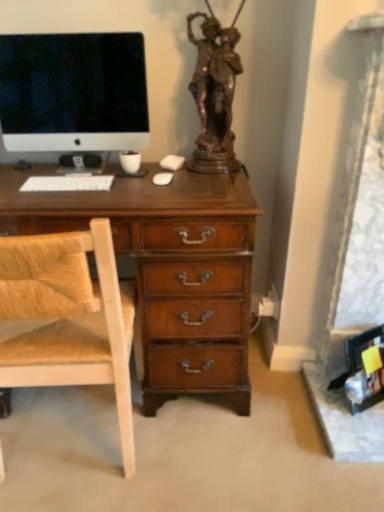
Question: Is light brown wood chair at left to the right of white glossy computer monitor at upper left from the viewer's perspective?

Choices:
 (A) no
 (B) yes

Answer: (B)

Question: Could white glossy computer monitor at upper left be considered to be inside light brown wood chair at left?

Choices:
 (A) yes
 (B) no

Answer: (B)

Question: Considering the relative sizes of light brown wood chair at left and white glossy computer monitor at upper left in the image provided, is light brown wood chair at left taller than white glossy computer monitor at upper left?

Choices:
 (A) yes
 (B) no

Answer: (A)

Question: From a real-world perspective, is light brown wood chair at left beneath white glossy computer monitor at upper left?

Choices:
 (A) no
 (B) yes

Answer: (B)

Question: From a real-world perspective, is light brown wood chair at left over white glossy computer monitor at upper left?

Choices:
 (A) yes
 (B) no

Answer: (B)

Question: Considering the positions of point (187, 32) and point (77, 181), is point (187, 32) closer or farther from the camera than point (77, 181)?

Choices:
 (A) farther
 (B) closer

Answer: (A)

Question: Is bronze statue at upper center taller or shorter than white matte keyboard at center?

Choices:
 (A) short
 (B) tall

Answer: (B)

Question: From a real-world perspective, is bronze statue at upper center positioned above or below white matte keyboard at center?

Choices:
 (A) below
 (B) above

Answer: (B)

Question: Is bronze statue at upper center wider or thinner than white matte keyboard at center?

Choices:
 (A) wide
 (B) thin

Answer: (A)

Question: From the image's perspective, is light brown wood chair at left positioned above or below white matte keyboard at center?

Choices:
 (A) above
 (B) below

Answer: (B)

Question: Would you say light brown wood chair at left is to the left or to the right of white matte keyboard at center in the picture?

Choices:
 (A) right
 (B) left

Answer: (A)

Question: Would you say light brown wood chair at left is inside or outside white matte keyboard at center?

Choices:
 (A) inside
 (B) outside

Answer: (B)

Question: In terms of size, does light brown wood chair at left appear bigger or smaller than white matte keyboard at center?

Choices:
 (A) big
 (B) small

Answer: (A)

Question: Considering the positions of point (129, 34) and point (41, 181), is point (129, 34) closer or farther from the camera than point (41, 181)?

Choices:
 (A) closer
 (B) farther

Answer: (B)

Question: Considering their positions, is white glossy computer monitor at upper left located in front of or behind white matte keyboard at center?

Choices:
 (A) front
 (B) behind

Answer: (B)